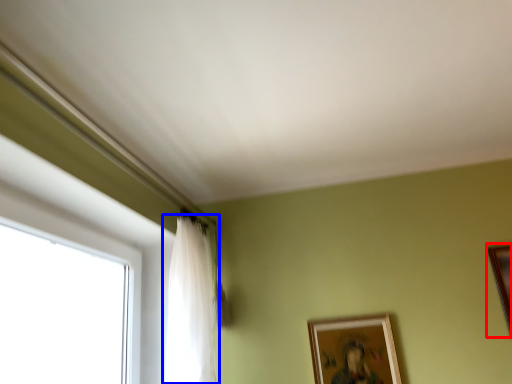
Question: Which of the following is the farthest to the observer, picture frame (highlighted by a red box) or curtain (highlighted by a blue box)?

Choices:
 (A) picture frame
 (B) curtain

Answer: (A)